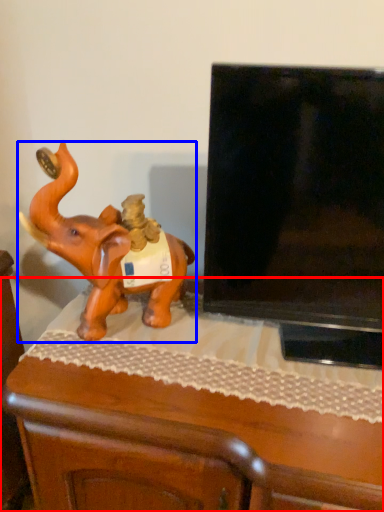
Question: Which of the following is the farthest to the observer, furniture (highlighted by a red box) or elephant (highlighted by a blue box)?

Choices:
 (A) furniture
 (B) elephant

Answer: (B)